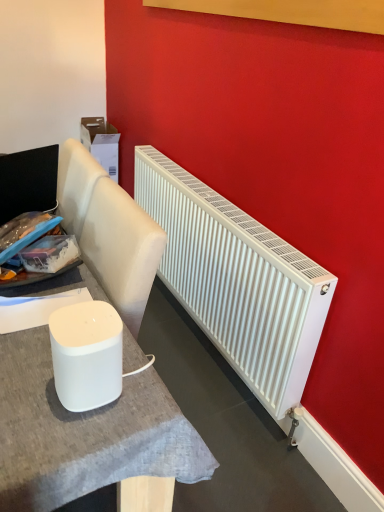
Image resolution: width=384 pixels, height=512 pixels. What are the coordinates of `vacant space to the right of white matte speaker at lower left` in the screenshot? It's located at (140, 399).